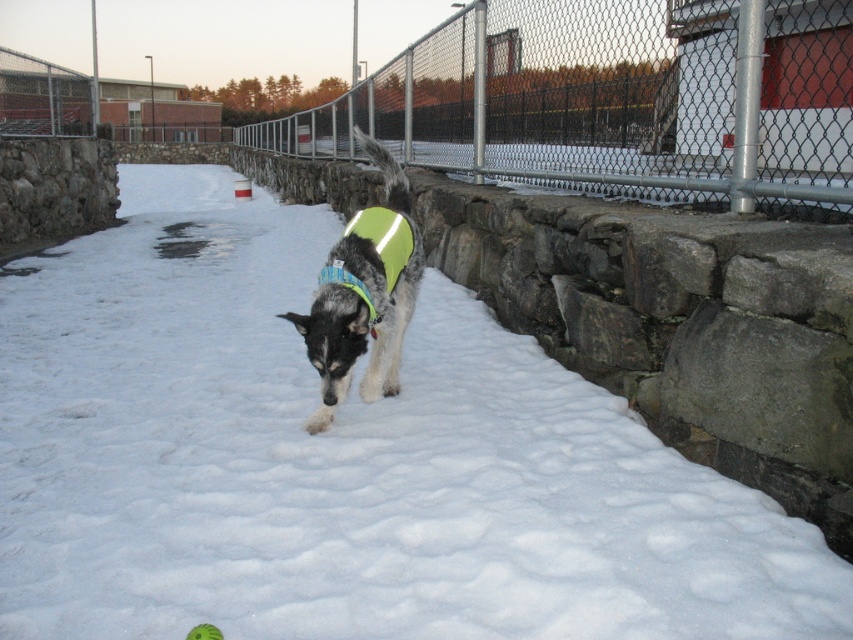
You are a hiker who just arrived at this snowy area. You see the white fluffy snow at center and the neon green fabric vest at center. Which one is located to the right side from your perspective?

The neon green fabric vest at center is located to the right side of the white fluffy snow at center, so the neon green fabric vest at center is on the right.